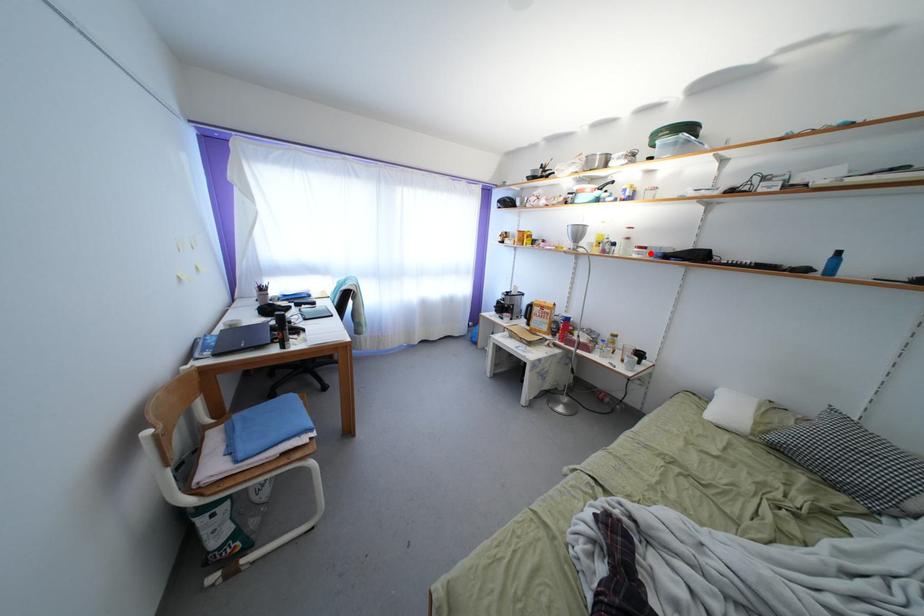
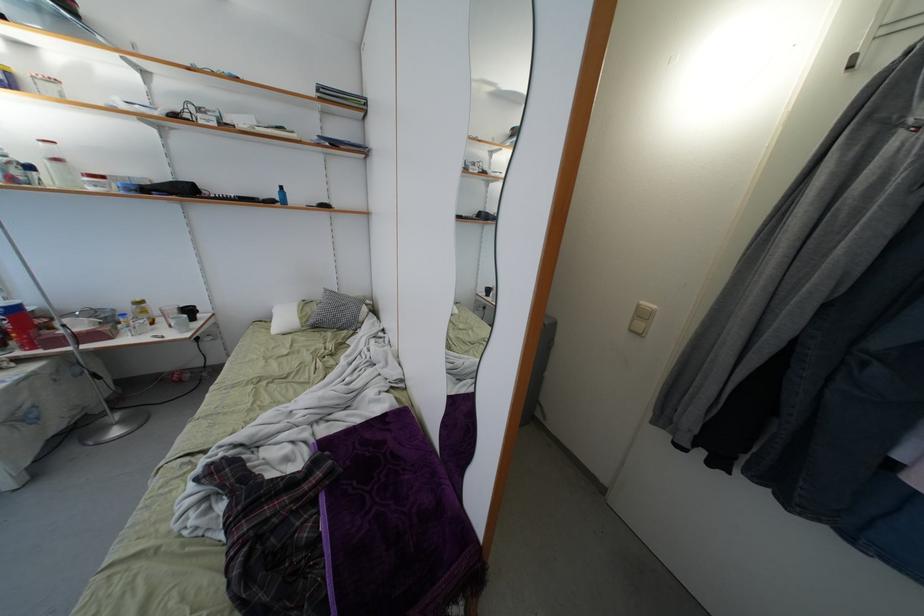
Find the pixel in the second image that matches the highlighted location in the first image.

(110, 184)